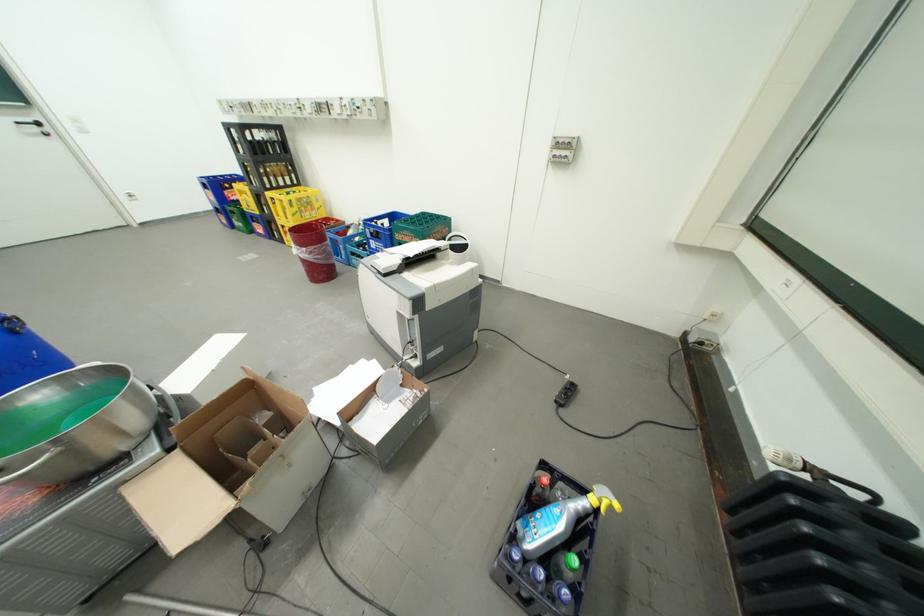
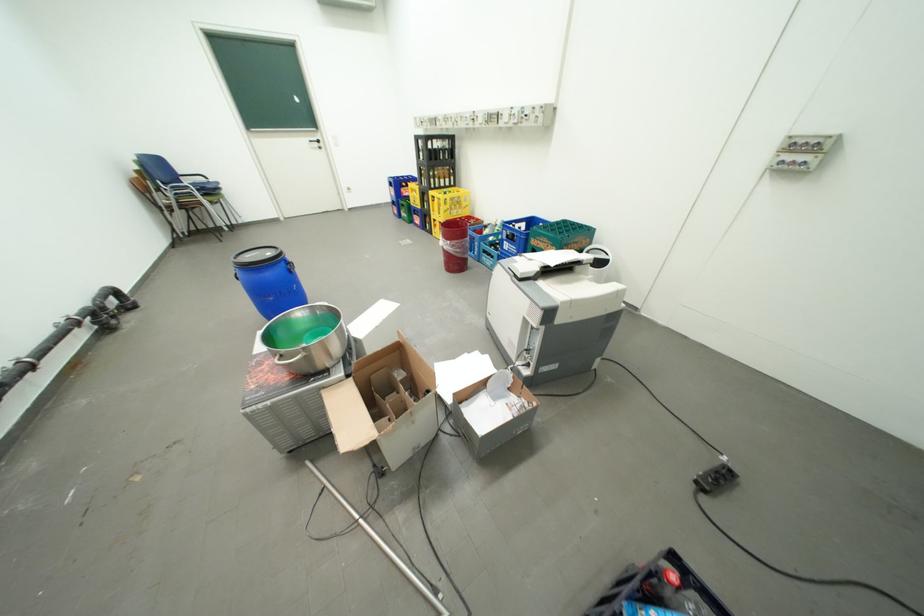
Question: Based on the continuous images, in which direction is the camera rotating? Reply with the corresponding letter.

Choices:
 (A) Left
 (B) Right
 (C) Up
 (D) Down

Answer: (A)